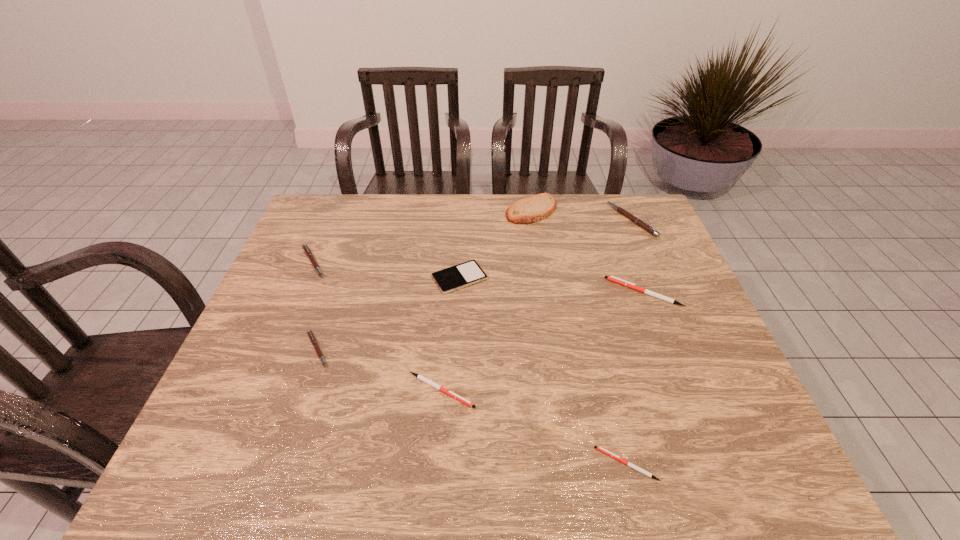
The height and width of the screenshot is (540, 960). In order to click on the tallest object in this screenshot , I will do `click(534, 208)`.

Find the location of a particular element. the rightmost pink pen is located at coordinates (639, 222).

Identify the location of the tallest pen. (639, 222).

Where is `the leftmost pen`? the leftmost pen is located at coordinates (305, 247).

Where is `the leftmost object`? This screenshot has width=960, height=540. the leftmost object is located at coordinates (305, 247).

Locate an element on the screen. The height and width of the screenshot is (540, 960). the biggest white pen is located at coordinates (614, 279).

Locate an element on the screen. This screenshot has width=960, height=540. the rightmost white pen is located at coordinates (614, 279).

I want to click on iPod, so (x=468, y=273).

Identify the location of the second pen from left to right. (311, 336).

You are a GUI agent. You are given a task and a screenshot of the screen. Output one action in this format:
    pyautogui.click(x=<x>, y=<y>)
    Task: Click on the second object from left to right
    The image size is (960, 540).
    Given the screenshot: What is the action you would take?
    pyautogui.click(x=311, y=336)